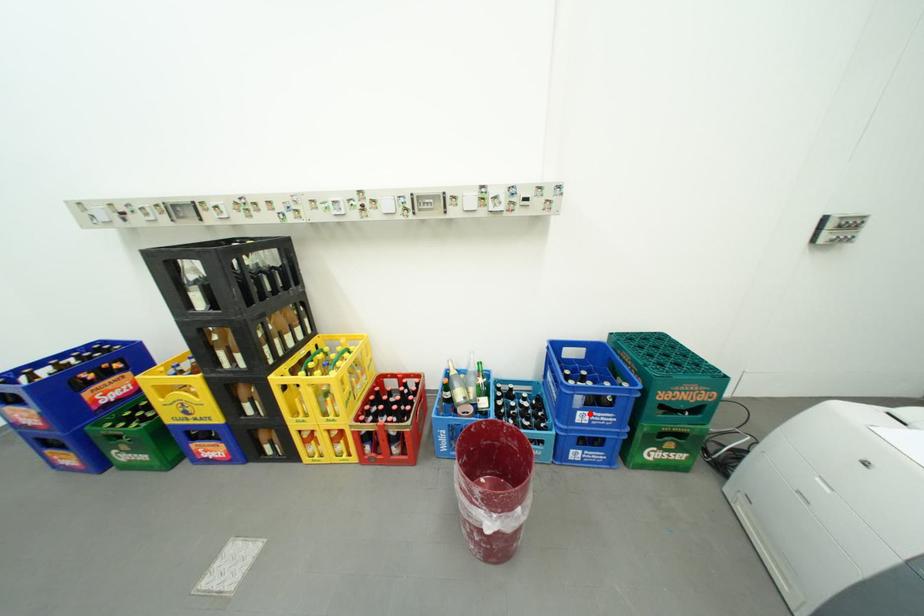
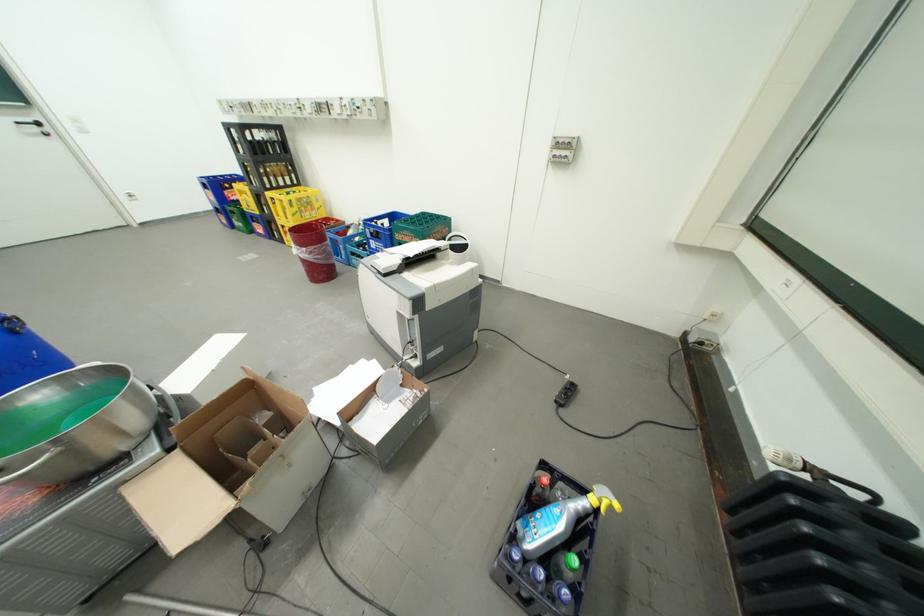
Question: I am providing you with two images of the same scene from different viewpoints. Image1 has a red point marked. In image2, the corresponding 3D location appears at what relative position? Reply with the corresponding letter.

Choices:
 (A) Closer
 (B) Farther

Answer: (B)